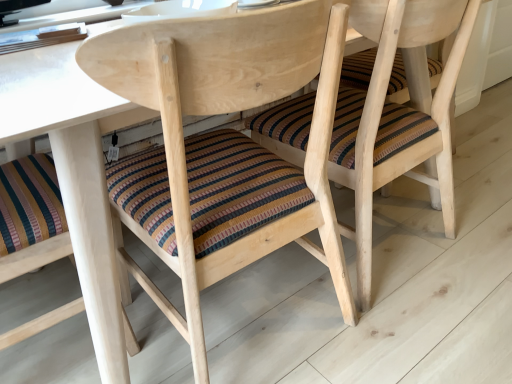
Locate an element on the screen. This screenshot has width=512, height=384. striped fabric cushion at center, the 2th chair in the left-to-right sequence is located at coordinates (396, 117).

Describe the element at coordinates (396, 117) in the screenshot. This screenshot has width=512, height=384. I see `striped fabric cushion at center, placed as the 1th chair when sorted from right to left` at that location.

What do you see at coordinates (225, 112) in the screenshot? This screenshot has height=384, width=512. I see `striped fabric cushion at center, marked as the first chair in a left-to-right arrangement` at bounding box center [225, 112].

You are a GUI agent. You are given a task and a screenshot of the screen. Output one action in this format:
    pyautogui.click(x=<x>, y=<y>)
    Task: Click on the striped fabric cushion at center, which ranks as the second chair in right-to-left order
    The width and height of the screenshot is (512, 384).
    Given the screenshot: What is the action you would take?
    pyautogui.click(x=225, y=112)

In the scene shown: What is the approximate width of striped fabric cushion at center, which ranks as the second chair in right-to-left order?

The width of striped fabric cushion at center, which ranks as the second chair in right-to-left order, is 56.73 centimeters.

Where is `striped fabric cushion at center, placed as the 1th chair when sorted from right to left`? striped fabric cushion at center, placed as the 1th chair when sorted from right to left is located at coordinates (396, 117).

Is striped fabric cushion at center, the 2th chair in the left-to-right sequence, to the left or to the right of striped fabric cushion at center, marked as the first chair in a left-to-right arrangement, in the image?

striped fabric cushion at center, the 2th chair in the left-to-right sequence, is positioned on striped fabric cushion at center, marked as the first chair in a left-to-right arrangement,'s right side.

Between striped fabric cushion at center, the 2th chair in the left-to-right sequence, and striped fabric cushion at center, marked as the first chair in a left-to-right arrangement, which one is positioned in front?

striped fabric cushion at center, marked as the first chair in a left-to-right arrangement.

Which point is more distant from viewer, (381, 13) or (197, 55)?

The point (381, 13) is behind.

From the image's perspective, is striped fabric cushion at center, placed as the 1th chair when sorted from right to left, over striped fabric cushion at center, which ranks as the second chair in right-to-left order?

Yes, from the image's perspective, striped fabric cushion at center, placed as the 1th chair when sorted from right to left, is on top of striped fabric cushion at center, which ranks as the second chair in right-to-left order.

From a real-world perspective, between striped fabric cushion at center, the 2th chair in the left-to-right sequence, and striped fabric cushion at center, which ranks as the second chair in right-to-left order, who is vertically higher?

striped fabric cushion at center, which ranks as the second chair in right-to-left order, from a real-world perspective.

Between striped fabric cushion at center, the 2th chair in the left-to-right sequence, and striped fabric cushion at center, which ranks as the second chair in right-to-left order, which one has smaller width?

With smaller width is striped fabric cushion at center, the 2th chair in the left-to-right sequence.

Between striped fabric cushion at center, the 2th chair in the left-to-right sequence, and striped fabric cushion at center, marked as the first chair in a left-to-right arrangement, which one has less height?

With less height is striped fabric cushion at center, the 2th chair in the left-to-right sequence.

Does striped fabric cushion at center, placed as the 1th chair when sorted from right to left, have a larger size compared to striped fabric cushion at center, which ranks as the second chair in right-to-left order?

No.

In the scene shown: Is striped fabric cushion at center, marked as the first chair in a left-to-right arrangement, surrounded by striped fabric cushion at center, the 2th chair in the left-to-right sequence?

Definitely not — striped fabric cushion at center, marked as the first chair in a left-to-right arrangement, is not inside striped fabric cushion at center, the 2th chair in the left-to-right sequence.

Is striped fabric cushion at center, the 2th chair in the left-to-right sequence, not close to striped fabric cushion at center, which ranks as the second chair in right-to-left order?

No, striped fabric cushion at center, the 2th chair in the left-to-right sequence, is in close proximity to striped fabric cushion at center, which ranks as the second chair in right-to-left order.

Is striped fabric cushion at center, the 2th chair in the left-to-right sequence, facing towards striped fabric cushion at center, which ranks as the second chair in right-to-left order?

No, striped fabric cushion at center, the 2th chair in the left-to-right sequence, is not aimed at striped fabric cushion at center, which ranks as the second chair in right-to-left order.

Can you tell me how much striped fabric cushion at center, placed as the 1th chair when sorted from right to left, and striped fabric cushion at center, which ranks as the second chair in right-to-left order, differ in facing direction?

The facing directions of striped fabric cushion at center, placed as the 1th chair when sorted from right to left, and striped fabric cushion at center, which ranks as the second chair in right-to-left order, are 0.257 degrees apart.

In order to click on chair behind the striped fabric cushion at center, marked as the first chair in a left-to-right arrangement in this screenshot , I will do [x=396, y=117].

Considering the relative positions of striped fabric cushion at center, marked as the first chair in a left-to-right arrangement, and striped fabric cushion at center, the 2th chair in the left-to-right sequence, in the image provided, is striped fabric cushion at center, marked as the first chair in a left-to-right arrangement, to the left or to the right of striped fabric cushion at center, the 2th chair in the left-to-right sequence,?

From the image, it's evident that striped fabric cushion at center, marked as the first chair in a left-to-right arrangement, is to the left of striped fabric cushion at center, the 2th chair in the left-to-right sequence.

Which is behind, striped fabric cushion at center, which ranks as the second chair in right-to-left order, or striped fabric cushion at center, the 2th chair in the left-to-right sequence?

striped fabric cushion at center, the 2th chair in the left-to-right sequence, is further from the camera.

Which point is more distant from viewer, (192, 271) or (381, 113)?

The point (381, 113) is more distant.

From the image's perspective, which one is positioned lower, striped fabric cushion at center, marked as the first chair in a left-to-right arrangement, or striped fabric cushion at center, the 2th chair in the left-to-right sequence?

striped fabric cushion at center, marked as the first chair in a left-to-right arrangement, is shown below in the image.

From a real-world perspective, does striped fabric cushion at center, which ranks as the second chair in right-to-left order, sit lower than striped fabric cushion at center, the 2th chair in the left-to-right sequence?

Incorrect, from a real-world perspective, striped fabric cushion at center, which ranks as the second chair in right-to-left order, is higher than striped fabric cushion at center, the 2th chair in the left-to-right sequence.

Considering the sizes of striped fabric cushion at center, which ranks as the second chair in right-to-left order, and striped fabric cushion at center, placed as the 1th chair when sorted from right to left, in the image, is striped fabric cushion at center, which ranks as the second chair in right-to-left order, wider or thinner than striped fabric cushion at center, placed as the 1th chair when sorted from right to left,?

Considering their sizes, striped fabric cushion at center, which ranks as the second chair in right-to-left order, looks broader than striped fabric cushion at center, placed as the 1th chair when sorted from right to left.

Considering the sizes of striped fabric cushion at center, which ranks as the second chair in right-to-left order, and striped fabric cushion at center, the 2th chair in the left-to-right sequence, in the image, is striped fabric cushion at center, which ranks as the second chair in right-to-left order, taller or shorter than striped fabric cushion at center, the 2th chair in the left-to-right sequence,?

Considering their sizes, striped fabric cushion at center, which ranks as the second chair in right-to-left order, has more height than striped fabric cushion at center, the 2th chair in the left-to-right sequence.

Which of these two, striped fabric cushion at center, marked as the first chair in a left-to-right arrangement, or striped fabric cushion at center, the 2th chair in the left-to-right sequence, is smaller?

striped fabric cushion at center, the 2th chair in the left-to-right sequence, is smaller.

Is striped fabric cushion at center, marked as the first chair in a left-to-right arrangement, outside of striped fabric cushion at center, the 2th chair in the left-to-right sequence?

Indeed, striped fabric cushion at center, marked as the first chair in a left-to-right arrangement, is completely outside striped fabric cushion at center, the 2th chair in the left-to-right sequence.

Does striped fabric cushion at center, which ranks as the second chair in right-to-left order, touch striped fabric cushion at center, placed as the 1th chair when sorted from right to left?

There is a gap between striped fabric cushion at center, which ranks as the second chair in right-to-left order, and striped fabric cushion at center, placed as the 1th chair when sorted from right to left.

In the scene shown: Is striped fabric cushion at center, marked as the first chair in a left-to-right arrangement, facing towards striped fabric cushion at center, the 2th chair in the left-to-right sequence?

No.

What's the angular difference between striped fabric cushion at center, marked as the first chair in a left-to-right arrangement, and striped fabric cushion at center, the 2th chair in the left-to-right sequence,'s facing directions?

The facing directions of striped fabric cushion at center, marked as the first chair in a left-to-right arrangement, and striped fabric cushion at center, the 2th chair in the left-to-right sequence, are 0.257 degrees apart.

How much distance is there between striped fabric cushion at center, which ranks as the second chair in right-to-left order, and striped fabric cushion at center, placed as the 1th chair when sorted from right to left?

A distance of 12.68 inches exists between striped fabric cushion at center, which ranks as the second chair in right-to-left order, and striped fabric cushion at center, placed as the 1th chair when sorted from right to left.

Locate an element on the screen. The image size is (512, 384). chair that is above the striped fabric cushion at center, which ranks as the second chair in right-to-left order (from the image's perspective) is located at coordinates (396, 117).

The image size is (512, 384). Identify the location of chair that appears below the striped fabric cushion at center, marked as the first chair in a left-to-right arrangement (from a real-world perspective). (396, 117).

Find the location of a particular element. This screenshot has width=512, height=384. chair lying below the striped fabric cushion at center, the 2th chair in the left-to-right sequence (from the image's perspective) is located at coordinates (225, 112).